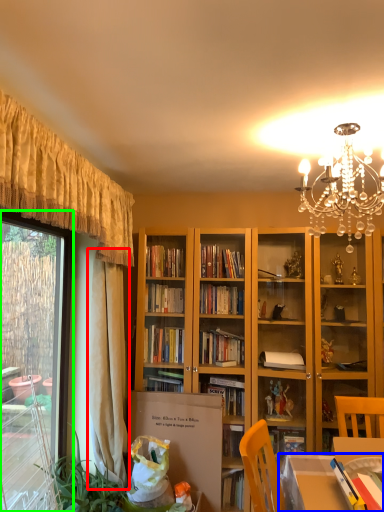
Question: Which is farther away from curtain (highlighted by a red box)? table (highlighted by a blue box) or window (highlighted by a green box)?

Choices:
 (A) table
 (B) window

Answer: (A)